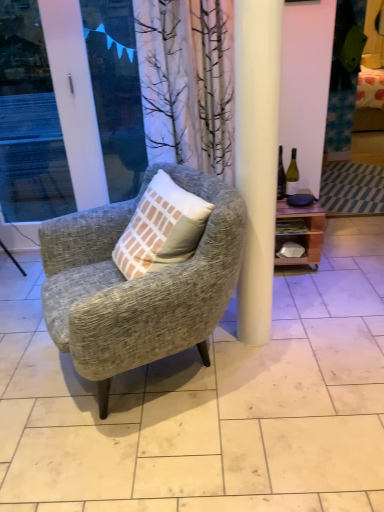
Where is `vacant area that lies to the right of wooden shelf at right`? This screenshot has width=384, height=512. vacant area that lies to the right of wooden shelf at right is located at coordinates (340, 258).